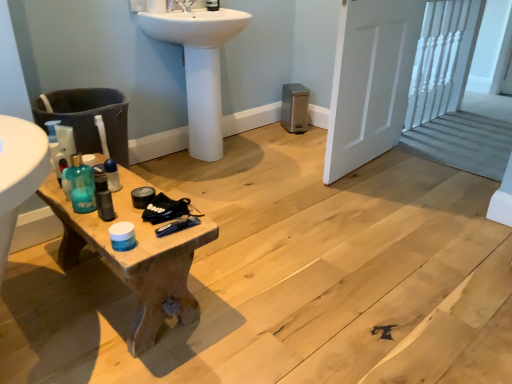
Question: Is matte black soap dispenser at upper center, the 2th toiletry from the left, smaller than translucent plastic bottle at left?

Choices:
 (A) yes
 (B) no

Answer: (B)

Question: From a real-world perspective, is matte black soap dispenser at upper center, the 1th toiletry in the back-to-front sequence, on top of translucent plastic bottle at left?

Choices:
 (A) no
 (B) yes

Answer: (B)

Question: Are matte black soap dispenser at upper center, the second toiletry positioned from the bottom, and translucent plastic bottle at left located far from each other?

Choices:
 (A) no
 (B) yes

Answer: (B)

Question: Does matte black soap dispenser at upper center, the 2th toiletry from the left, have a greater height compared to translucent plastic bottle at left?

Choices:
 (A) no
 (B) yes

Answer: (B)

Question: Is matte black soap dispenser at upper center, the second toiletry positioned from the bottom, outside translucent plastic bottle at left?

Choices:
 (A) no
 (B) yes

Answer: (B)

Question: From the image's perspective, is white glossy sink at upper center above or below white wooden door at right?

Choices:
 (A) above
 (B) below

Answer: (A)

Question: Does point (216, 44) appear closer or farther from the camera than point (385, 109)?

Choices:
 (A) farther
 (B) closer

Answer: (B)

Question: Which is correct: white glossy sink at upper center is inside white wooden door at right, or outside of it?

Choices:
 (A) inside
 (B) outside

Answer: (B)

Question: Based on their positions, is white glossy sink at upper center located to the left or right of white wooden door at right?

Choices:
 (A) right
 (B) left

Answer: (B)

Question: Is woodenwoodentable at left bigger or smaller than translucent plastic bottle at left?

Choices:
 (A) small
 (B) big

Answer: (B)

Question: From a real-world perspective, relative to translucent plastic bottle at left, is woodenwoodentable at left vertically above or below?

Choices:
 (A) below
 (B) above

Answer: (A)

Question: Visually, is woodenwoodentable at left positioned to the left or to the right of translucent plastic bottle at left?

Choices:
 (A) right
 (B) left

Answer: (A)

Question: Is woodenwoodentable at left taller or shorter than translucent plastic bottle at left?

Choices:
 (A) tall
 (B) short

Answer: (A)

Question: Based on their sizes in the image, would you say woodenwoodentable at left is bigger or smaller than translucent plastic bottle at center, which ranks as the 1th toiletry in front-to-back order?

Choices:
 (A) big
 (B) small

Answer: (A)

Question: Do you think woodenwoodentable at left is within translucent plastic bottle at center, which ranks as the 1th toiletry in front-to-back order, or outside of it?

Choices:
 (A) outside
 (B) inside

Answer: (A)